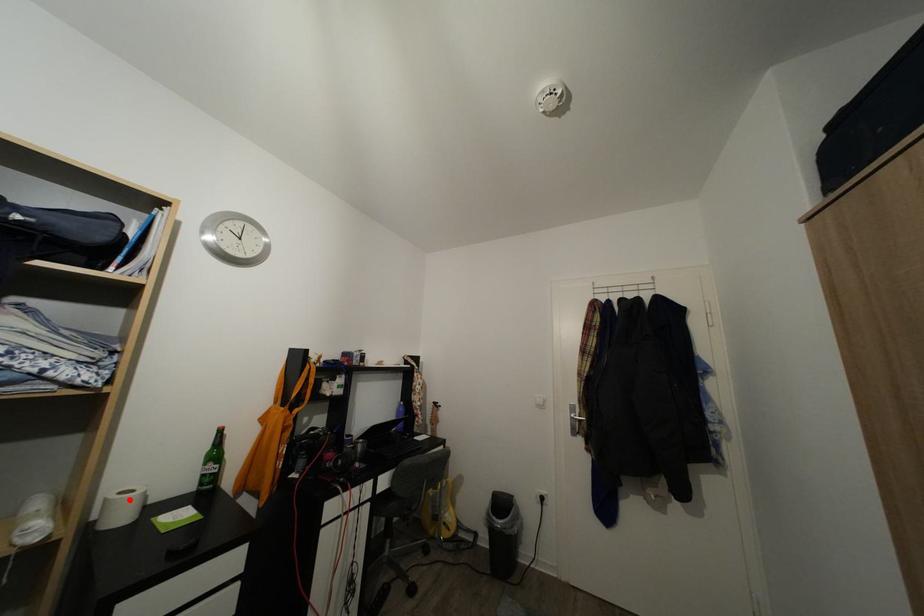
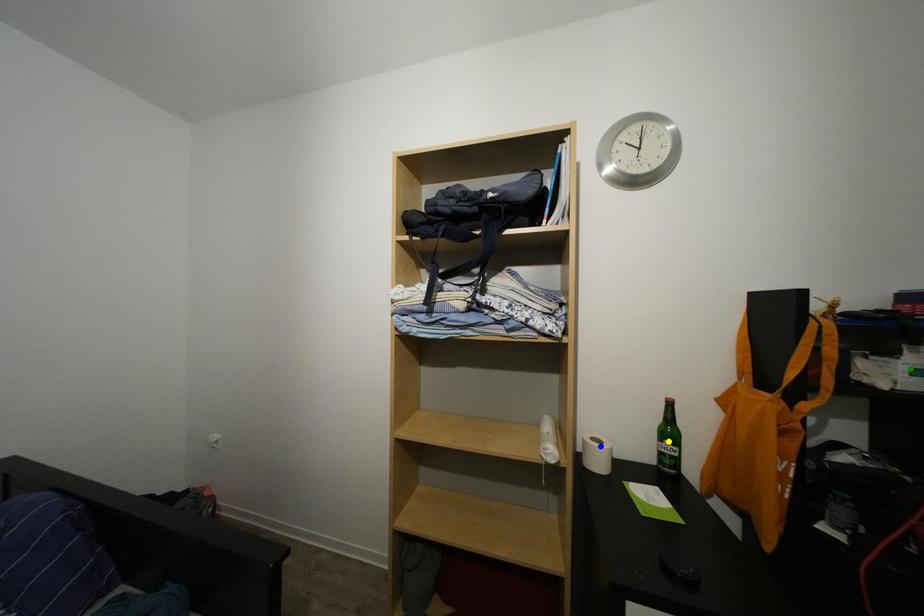
Question: I am providing you with two images of the same scene from different viewpoints. A red point is marked on the first image. You are given multiple points on the second image. Can you choose the point in image 2 that corresponds to the point in image 1?

Choices:
 (A) green point
 (B) blue point
 (C) yellow point

Answer: (B)